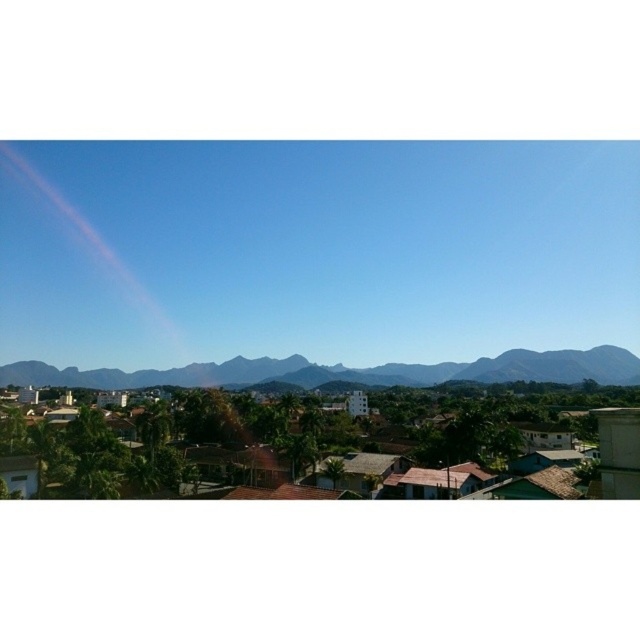
You are an artist planning to paint the suburban landscape. You notice the transparent iridescent rainbow at upper left and the gray rocky mountain at center. Which object is located above the other?

The transparent iridescent rainbow at upper left is positioned over gray rocky mountain at center, so it is above the mountain.

You are an aerial photographer planning to capture the suburban area. You need to focus on the gray rocky mountain at center and the green leafy mountains at center. Which mountain group will take up more space in your photo?

The green leafy mountains at center occupy more space than the gray rocky mountain at center in the photo.

You are an artist planning to paint the suburban landscape. You notice the transparent iridescent rainbow at upper left and the green leafy mountains at center. Which object appears closer to the viewer in the scene?

The transparent iridescent rainbow at upper left appears closer to the viewer because it is positioned over the green leafy mountains at center, indicating it is layered in front of them.